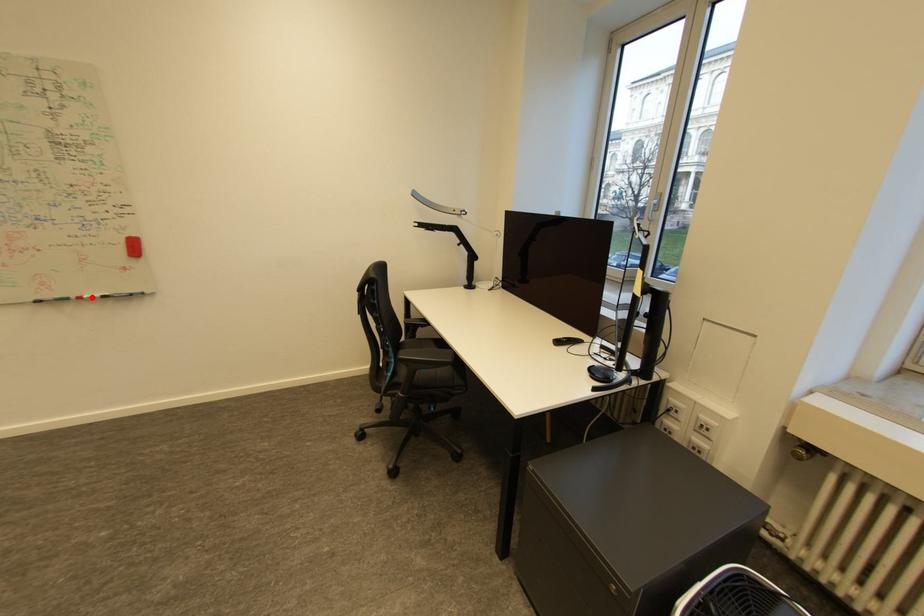
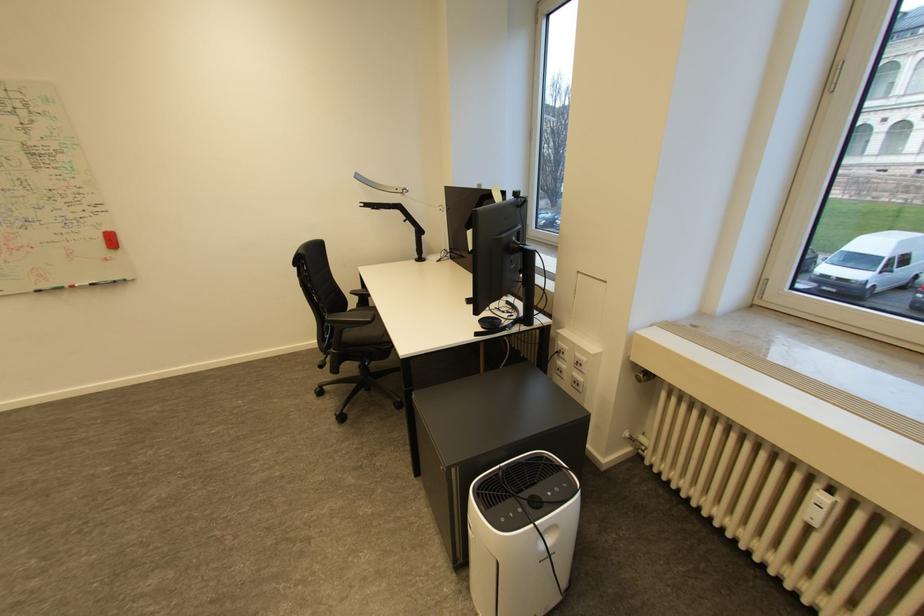
Question: I am providing you with two images of the same scene from different viewpoints. Image1 has a red point marked. In image2, the corresponding 3D location appears at what relative position? Reply with the corresponding letter.

Choices:
 (A) Closer
 (B) Farther

Answer: (B)